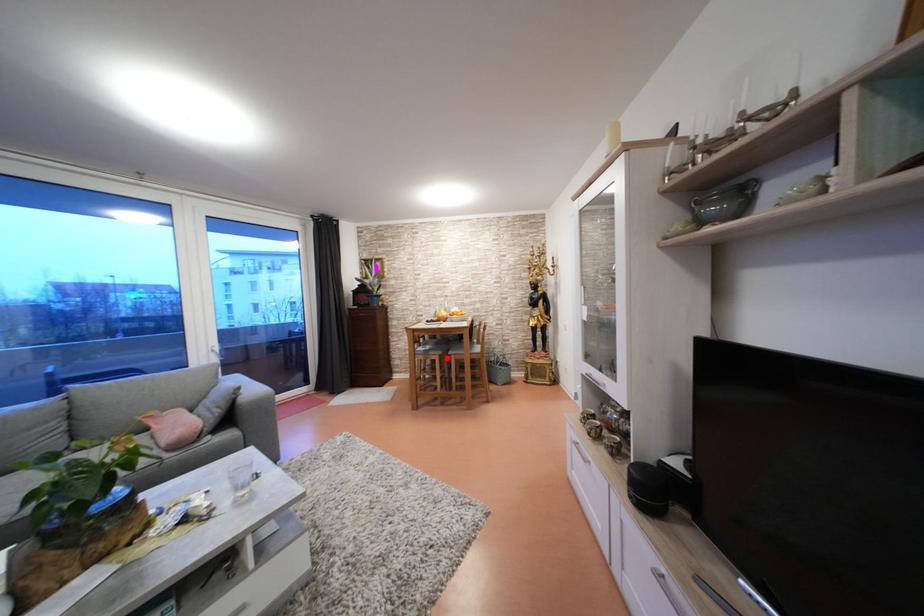
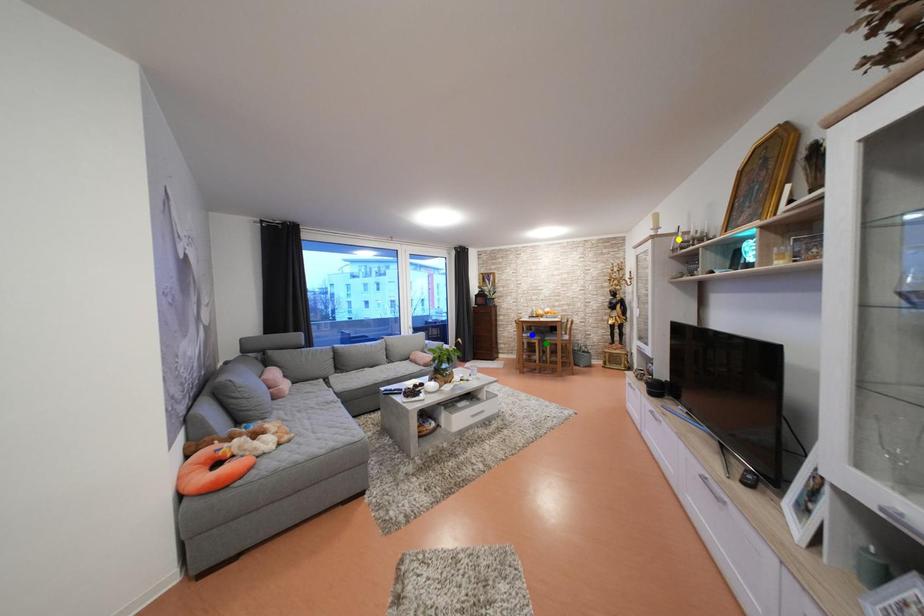
Question: I am providing you with two images of the same scene from different viewpoints. A red point is marked on the first image. You are given multiple points on the second image. Which mark in image 2 goes with the point in image 1?

Choices:
 (A) blue point
 (B) yellow point
 (C) green point

Answer: (C)